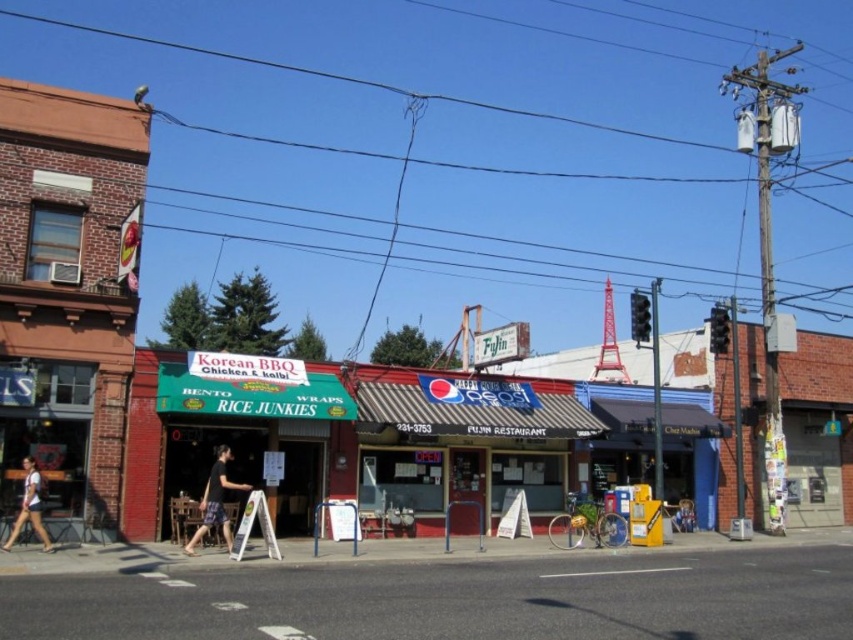
Does black wire at upper center appear over smooth asphalt road at lower center?

Indeed, black wire at upper center is positioned over smooth asphalt road at lower center.

This screenshot has height=640, width=853. What are the coordinates of `black wire at upper center` in the screenshot? It's located at (445, 147).

Locate an element on the screen. The width and height of the screenshot is (853, 640). black wire at upper center is located at coordinates (445, 147).

Is black wire at upper center below white cotton shirt at lower left?

Incorrect, black wire at upper center is not positioned below white cotton shirt at lower left.

Between point (685, 52) and point (22, 513), which one is positioned in front?

Point (22, 513) is in front.

The width and height of the screenshot is (853, 640). Identify the location of black wire at upper center. (445, 147).

Is black wire at upper center bigger than black cotton t-shirt at center?

Indeed, black wire at upper center has a larger size compared to black cotton t-shirt at center.

Does black wire at upper center have a lesser width compared to black cotton t-shirt at center?

No.

Who is more distant from viewer, (33,33) or (193,545)?

The point (33,33) is behind.

Locate an element on the screen. The width and height of the screenshot is (853, 640). black wire at upper center is located at coordinates (445, 147).